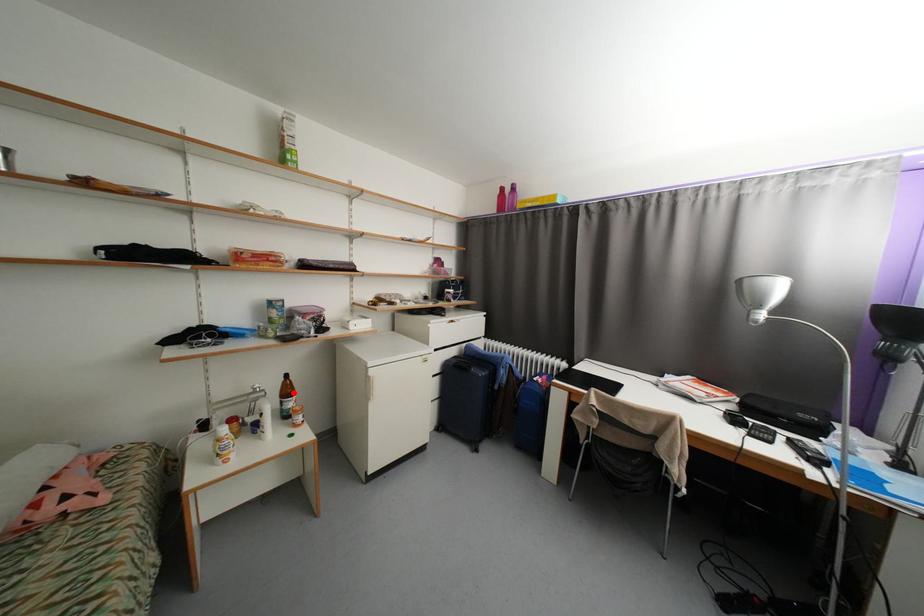
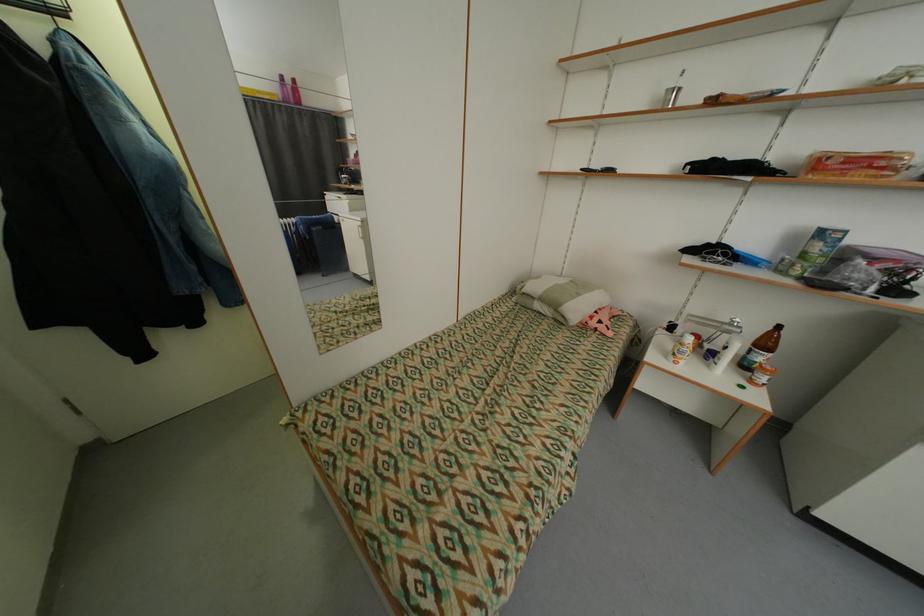
Where in the second image is the point corresponding to the highlighted location from the first image?

(772, 345)